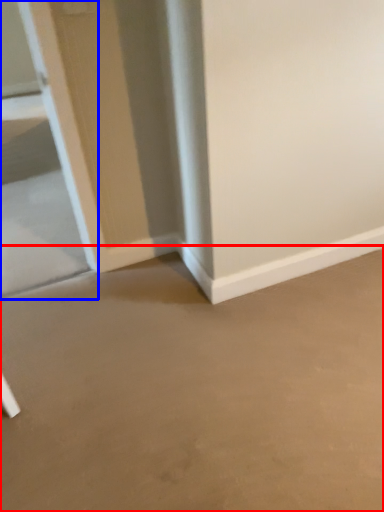
Question: Which object appears closest to the camera in this image, concrete (highlighted by a red box) or glass door (highlighted by a blue box)?

Choices:
 (A) concrete
 (B) glass door

Answer: (A)